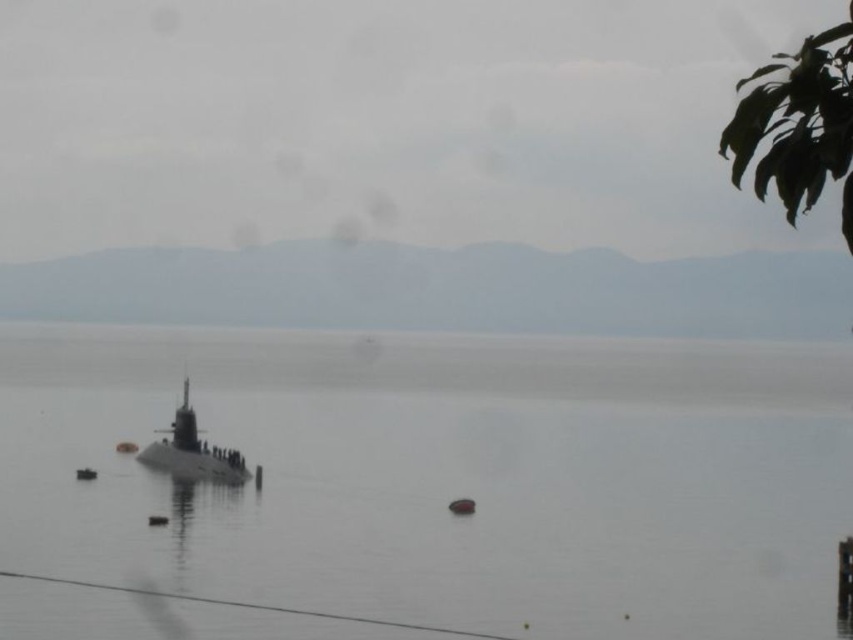
Question: Observing the image, what is the correct spatial positioning of smooth gray water at center in reference to gray metallic submarine at center?

Choices:
 (A) right
 (B) left

Answer: (A)

Question: Which object appears closest to the camera in this image?

Choices:
 (A) smooth gray water at center
 (B) gray metallic submarine at center

Answer: (A)

Question: Does smooth gray water at center lie in front of gray metallic submarine at center?

Choices:
 (A) yes
 (B) no

Answer: (A)

Question: Which object is farther from the camera taking this photo?

Choices:
 (A) smooth gray water at center
 (B) gray metallic submarine at center

Answer: (B)

Question: Where is smooth gray water at center located in relation to gray metallic submarine at center in the image?

Choices:
 (A) right
 (B) left

Answer: (A)